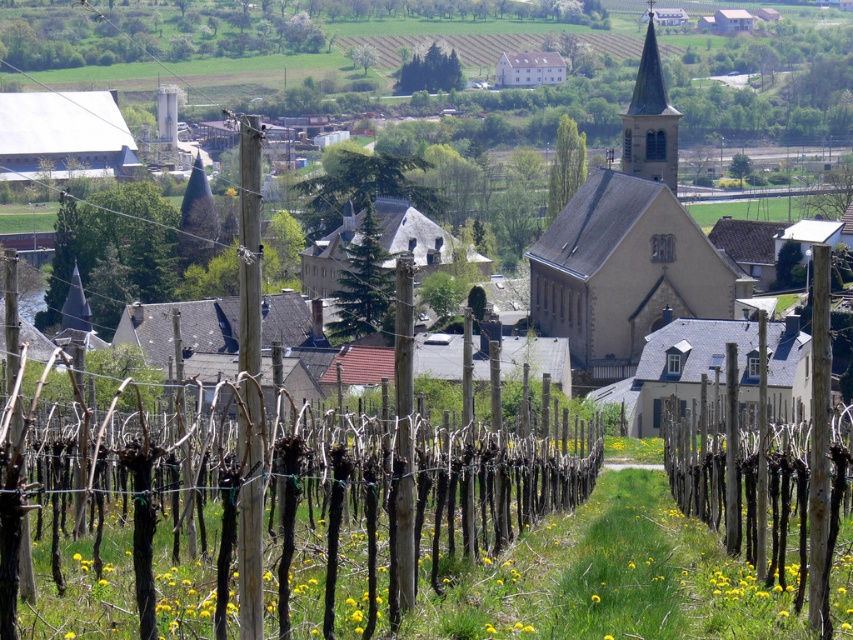
Is brown wooden fence at lower right behind smooth stone spire at upper center?

No, brown wooden fence at lower right is closer to the viewer.

Who is more forward, (x=717, y=502) or (x=634, y=147)?

Positioned in front is point (x=717, y=502).

Identify the location of brown wooden fence at lower right. The image size is (853, 640). (766, 484).

Who is positioned more to the left, brown wooden fence at center or brown wooden pole at center?

Positioned to the left is brown wooden pole at center.

Is brown wooden fence at center to the left of brown wooden pole at center from the viewer's perspective?

Incorrect, brown wooden fence at center is not on the left side of brown wooden pole at center.

Which is behind, point (277, 458) or point (257, 404)?

Point (277, 458)

Find the location of a particular element. brown wooden fence at center is located at coordinates (416, 493).

Does brown wooden fence at center come behind stone church at center?

No, it is not.

Does brown wooden fence at center have a greater height compared to stone church at center?

No, brown wooden fence at center is not taller than stone church at center.

Who is more forward, (387, 589) or (579, 349)?

Point (387, 589) is in front.

At what (x,y) coordinates should I click in order to perform the action: click on brown wooden fence at center. Please return your answer as a coordinate pair (x, y). Looking at the image, I should click on coord(416,493).